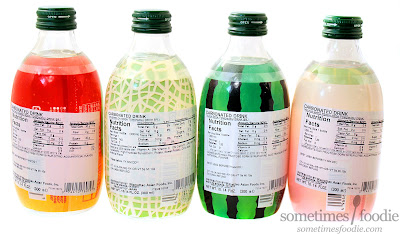
Identify the location of far left bottle. (21, 90).